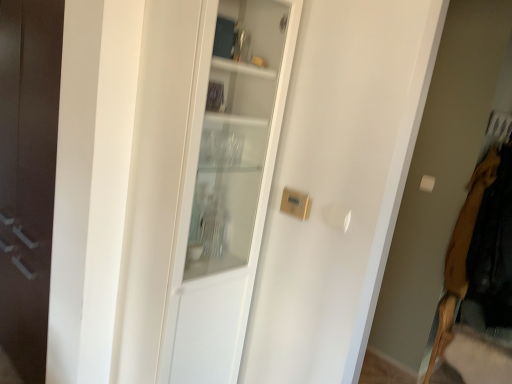
Question: Considering the relative positions of white glass cabinet at center and velvet brown coat at right in the image provided, is white glass cabinet at center to the left of velvet brown coat at right from the viewer's perspective?

Choices:
 (A) yes
 (B) no

Answer: (A)

Question: Is the surface of white glass cabinet at center in direct contact with velvet brown coat at right?

Choices:
 (A) yes
 (B) no

Answer: (B)

Question: Can you confirm if white glass cabinet at center is bigger than velvet brown coat at right?

Choices:
 (A) no
 (B) yes

Answer: (A)

Question: Can you confirm if white glass cabinet at center is taller than velvet brown coat at right?

Choices:
 (A) yes
 (B) no

Answer: (A)

Question: Considering the relative sizes of white glass cabinet at center and velvet brown coat at right in the image provided, is white glass cabinet at center shorter than velvet brown coat at right?

Choices:
 (A) no
 (B) yes

Answer: (A)

Question: Is white glass cabinet at center behind velvet brown coat at right?

Choices:
 (A) yes
 (B) no

Answer: (B)

Question: Does velvet brown coat at right come in front of white glass cabinet at center?

Choices:
 (A) no
 (B) yes

Answer: (A)

Question: Is velvet brown coat at right smaller than white glass cabinet at center?

Choices:
 (A) no
 (B) yes

Answer: (A)

Question: Is velvet brown coat at right thinner than white glass cabinet at center?

Choices:
 (A) no
 (B) yes

Answer: (A)

Question: Is velvet brown coat at right not inside white glass cabinet at center?

Choices:
 (A) yes
 (B) no

Answer: (A)

Question: Is velvet brown coat at right next to white glass cabinet at center and touching it?

Choices:
 (A) yes
 (B) no

Answer: (B)

Question: Is white glass cabinet at center completely or partially inside velvet brown coat at right?

Choices:
 (A) yes
 (B) no

Answer: (B)

Question: Is velvet brown coat at right in front of or behind white glass cabinet at center in the image?

Choices:
 (A) behind
 (B) front

Answer: (A)